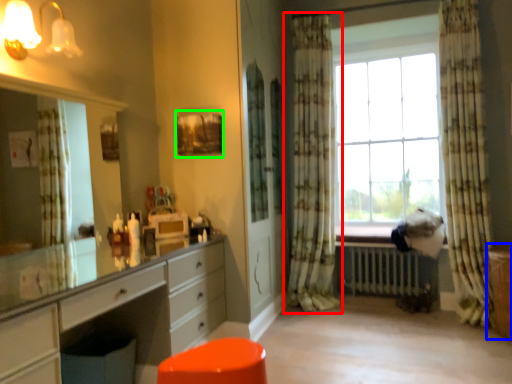
Question: Considering the real-world distances, which object is closest to curtain (highlighted by a red box)? file cabinet (highlighted by a blue box) or picture frame (highlighted by a green box).

Choices:
 (A) file cabinet
 (B) picture frame

Answer: (B)